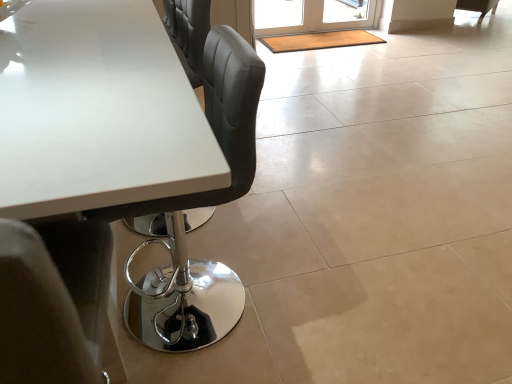
Question: Should I look upward or downward to see white glossy table at upper left?

Choices:
 (A) down
 (B) up

Answer: (B)

Question: Considering the relative sizes of translucent glass screen door at upper center and white glossy table at upper left in the image provided, is translucent glass screen door at upper center thinner than white glossy table at upper left?

Choices:
 (A) yes
 (B) no

Answer: (A)

Question: Can you confirm if translucent glass screen door at upper center is wider than white glossy table at upper left?

Choices:
 (A) yes
 (B) no

Answer: (B)

Question: Can you confirm if translucent glass screen door at upper center is smaller than white glossy table at upper left?

Choices:
 (A) yes
 (B) no

Answer: (A)

Question: From a real-world perspective, does translucent glass screen door at upper center sit lower than white glossy table at upper left?

Choices:
 (A) yes
 (B) no

Answer: (A)

Question: Considering the relative sizes of translucent glass screen door at upper center and white glossy table at upper left in the image provided, is translucent glass screen door at upper center taller than white glossy table at upper left?

Choices:
 (A) yes
 (B) no

Answer: (B)

Question: Is translucent glass screen door at upper center oriented towards white glossy table at upper left?

Choices:
 (A) yes
 (B) no

Answer: (B)

Question: Considering the relative sizes of white glossy table at upper left and translucent glass screen door at upper center in the image provided, is white glossy table at upper left thinner than translucent glass screen door at upper center?

Choices:
 (A) no
 (B) yes

Answer: (A)

Question: Can you confirm if white glossy table at upper left is smaller than translucent glass screen door at upper center?

Choices:
 (A) no
 (B) yes

Answer: (A)

Question: From the image's perspective, is white glossy table at upper left over translucent glass screen door at upper center?

Choices:
 (A) yes
 (B) no

Answer: (B)

Question: Does white glossy table at upper left have a greater width compared to translucent glass screen door at upper center?

Choices:
 (A) no
 (B) yes

Answer: (B)

Question: Is white glossy table at upper left at the left side of translucent glass screen door at upper center?

Choices:
 (A) yes
 (B) no

Answer: (A)

Question: Does white glossy table at upper left have a lesser height compared to translucent glass screen door at upper center?

Choices:
 (A) yes
 (B) no

Answer: (B)

Question: Does white glossy table at upper left lie behind matte black chair at upper right?

Choices:
 (A) no
 (B) yes

Answer: (A)